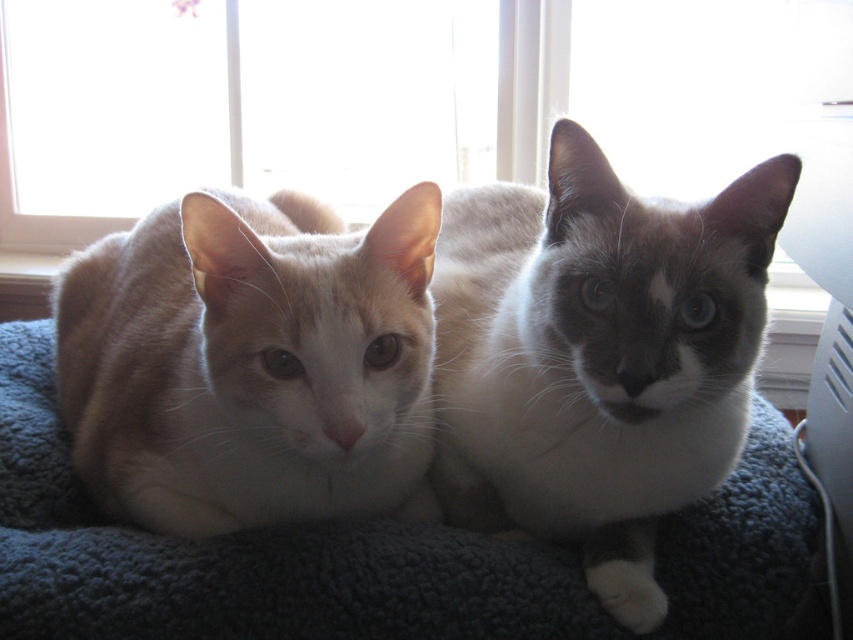
Question: Estimate the real-world distances between objects in this image. Which object is farther from the silky white cat at center?

Choices:
 (A) matte white cat at left
 (B) transparent glass window at upper center

Answer: (B)

Question: Does silky white cat at center appear under dark blue fleece at center?

Choices:
 (A) no
 (B) yes

Answer: (A)

Question: Considering the relative positions of silky white cat at center and matte white cat at left in the image provided, where is silky white cat at center located with respect to matte white cat at left?

Choices:
 (A) below
 (B) above

Answer: (B)

Question: Is matte white cat at left smaller than dark blue fleece at center?

Choices:
 (A) no
 (B) yes

Answer: (B)

Question: Among these points, which one is farthest from the camera?

Choices:
 (A) (341, 113)
 (B) (537, 637)
 (C) (502, 483)
 (D) (432, 232)

Answer: (A)

Question: Which point is closer to the camera taking this photo?

Choices:
 (A) (299, 24)
 (B) (30, 333)
 (C) (451, 348)
 (D) (335, 444)

Answer: (D)